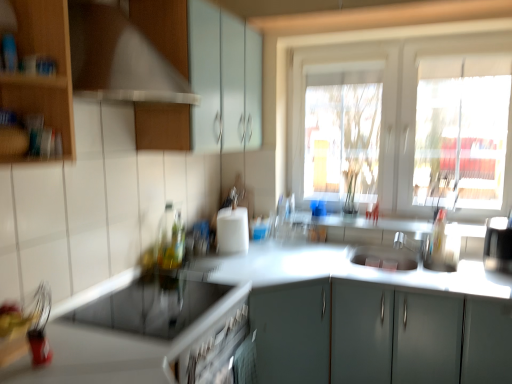
Identify the location of space that is in front of translucent glass bottle at center, the 1th bottle viewed from the front. Image resolution: width=512 pixels, height=384 pixels. (175, 276).